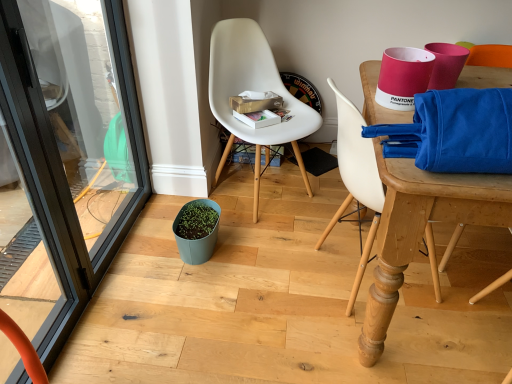
Question: Is teal matte flowerpot at center at the right side of white plastic chair at center, which is the second chair from right to left?

Choices:
 (A) yes
 (B) no

Answer: (B)

Question: Does teal matte flowerpot at center lie behind white plastic chair at center, placed as the 1th chair when sorted from left to right?

Choices:
 (A) yes
 (B) no

Answer: (A)

Question: From the image's perspective, is teal matte flowerpot at center over white plastic chair at center, placed as the 1th chair when sorted from left to right?

Choices:
 (A) no
 (B) yes

Answer: (A)

Question: Could white plastic chair at center, which is the second chair from right to left, be considered to be inside teal matte flowerpot at center?

Choices:
 (A) no
 (B) yes

Answer: (A)

Question: Does teal matte flowerpot at center have a greater width compared to white plastic chair at center, which is the second chair from right to left?

Choices:
 (A) yes
 (B) no

Answer: (B)

Question: Is teal matte flowerpot at center not near white plastic chair at center, which is the second chair from right to left?

Choices:
 (A) yes
 (B) no

Answer: (B)

Question: Can you confirm if white plastic chair at upper right, marked as the 1th chair in a right-to-left arrangement, is positioned to the right of white plastic chair at center, which is the second chair from right to left?

Choices:
 (A) yes
 (B) no

Answer: (A)

Question: Is white plastic chair at center, which is the second chair from right to left, completely or partially inside white plastic chair at upper right, the 2th chair viewed from the left?

Choices:
 (A) no
 (B) yes

Answer: (A)

Question: Is white plastic chair at upper right, marked as the 1th chair in a right-to-left arrangement, aimed at white plastic chair at center, which is the second chair from right to left?

Choices:
 (A) yes
 (B) no

Answer: (B)

Question: Considering the relative sizes of white plastic chair at upper right, marked as the 1th chair in a right-to-left arrangement, and white plastic chair at center, which is the second chair from right to left, in the image provided, is white plastic chair at upper right, marked as the 1th chair in a right-to-left arrangement, smaller than white plastic chair at center, which is the second chair from right to left,?

Choices:
 (A) no
 (B) yes

Answer: (B)

Question: Considering the relative sizes of white plastic chair at upper right, the 2th chair viewed from the left, and white plastic chair at center, placed as the 1th chair when sorted from left to right, in the image provided, is white plastic chair at upper right, the 2th chair viewed from the left, shorter than white plastic chair at center, placed as the 1th chair when sorted from left to right,?

Choices:
 (A) yes
 (B) no

Answer: (A)

Question: From the image's perspective, is white plastic chair at upper right, the 2th chair viewed from the left, under white plastic chair at center, which is the second chair from right to left?

Choices:
 (A) yes
 (B) no

Answer: (A)

Question: Considering the relative positions of black glass screen door at left and white plastic chair at upper right, marked as the 1th chair in a right-to-left arrangement, in the image provided, is black glass screen door at left behind white plastic chair at upper right, marked as the 1th chair in a right-to-left arrangement,?

Choices:
 (A) yes
 (B) no

Answer: (B)